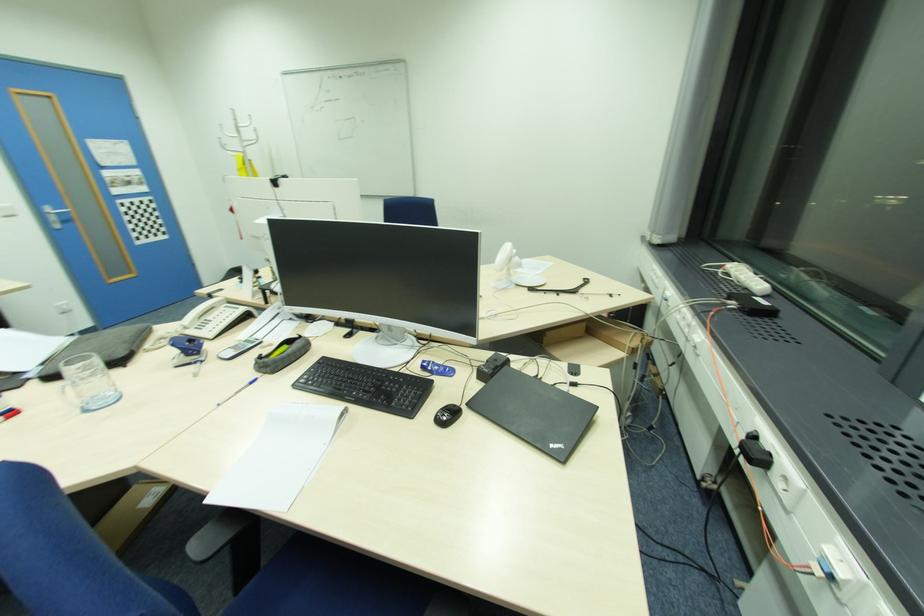
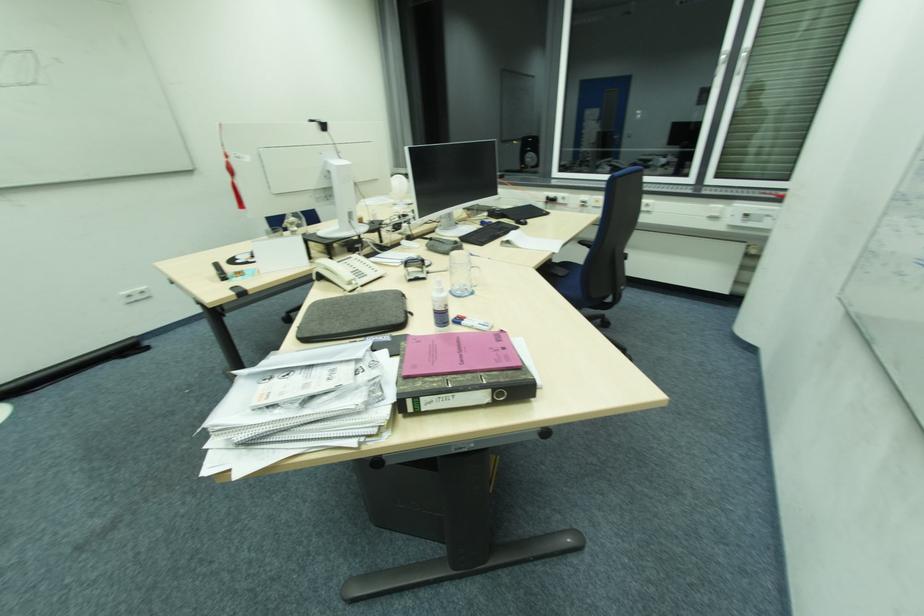
Where in the second image is the point corresponding to (x=228, y=306) from the first image?

(342, 262)